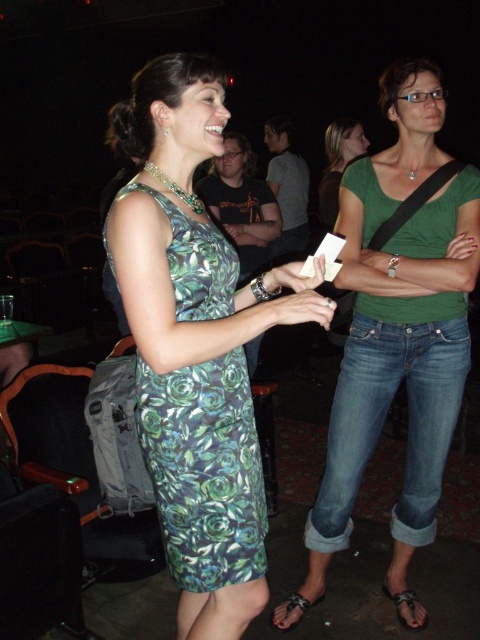
Is point (274, 147) closer to camera compared to point (297, 602)?

No, (274, 147) is further to viewer.

Who is taller, dark gray shirt at center or leather sandal at lower center?

Standing taller between the two is dark gray shirt at center.

Which is behind, point (280, 129) or point (292, 596)?

The point (280, 129) is behind.

The width and height of the screenshot is (480, 640). I want to click on dark gray shirt at center, so coord(287,188).

Is green floral dress at center shorter than dark green t-shirt at center?

No, green floral dress at center is not shorter than dark green t-shirt at center.

The image size is (480, 640). What do you see at coordinates (204, 468) in the screenshot? I see `green floral dress at center` at bounding box center [204, 468].

You are a GUI agent. You are given a task and a screenshot of the screen. Output one action in this format:
    pyautogui.click(x=<x>, y=<y>)
    Task: Click on the green floral dress at center
    The image size is (480, 640).
    Given the screenshot: What is the action you would take?
    (x=204, y=468)

Locate an element on the screen. green cotton shirt at center is located at coordinates (398, 324).

At what (x,y) coordinates should I click in order to perform the action: click on green cotton shirt at center. Please return your answer as a coordinate pair (x, y). Looking at the image, I should click on (398, 324).

Locate an element on the screen. green cotton shirt at center is located at coordinates (398, 324).